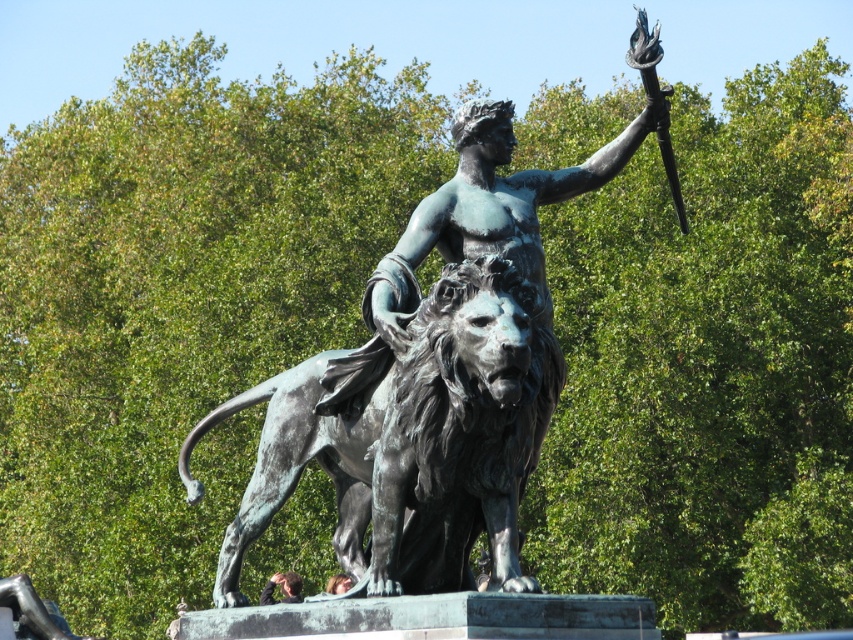
Is the position of bronze statue at center less distant than that of bronze textured lion at center?

No.

Is bronze statue at center thinner than bronze textured lion at center?

No.

Is point (389, 316) less distant than point (392, 428)?

No.

The image size is (853, 640). What are the coordinates of `bronze statue at center` in the screenshot? It's located at (434, 372).